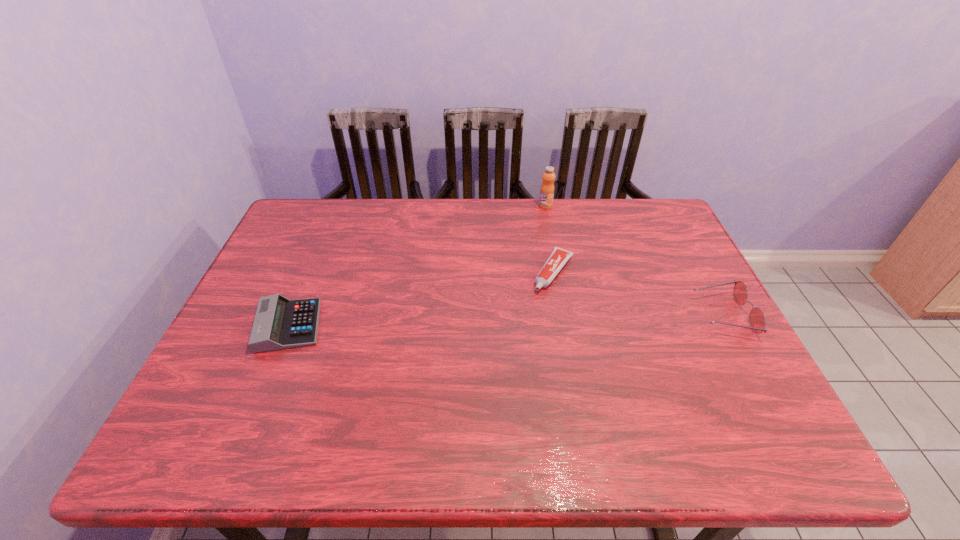
You are a GUI agent. You are given a task and a screenshot of the screen. Output one action in this format:
    pyautogui.click(x=<x>, y=<y>)
    Task: Click on the free space between the toothpaste and the calculator
    The image size is (960, 540).
    Given the screenshot: What is the action you would take?
    pyautogui.click(x=421, y=299)

I want to click on free space between the leftmost object and the third shortest object, so click(506, 320).

The height and width of the screenshot is (540, 960). What are the coordinates of `free area in between the third shortest object and the toothpaste` in the screenshot? It's located at (638, 294).

This screenshot has height=540, width=960. I want to click on vacant area between the second tallest object and the toothpaste, so click(x=638, y=294).

Find the location of a particular element. The height and width of the screenshot is (540, 960). empty location between the farthest object and the calculator is located at coordinates (418, 266).

Locate an element on the screen. vacant space that is in between the rightmost object and the farthest object is located at coordinates (634, 260).

Identify the location of object that is the second closest to the orange juice. The height and width of the screenshot is (540, 960). (757, 320).

This screenshot has width=960, height=540. Find the location of `object that is the second nearest to the toothpaste`. object that is the second nearest to the toothpaste is located at coordinates (757, 320).

Find the location of `free space that satisfies the following two spatial constraints: 1. on the back side of the leftmost object; 2. on the front-facing side of the spectacles`. free space that satisfies the following two spatial constraints: 1. on the back side of the leftmost object; 2. on the front-facing side of the spectacles is located at coordinates (294, 315).

The height and width of the screenshot is (540, 960). I want to click on blank space that satisfies the following two spatial constraints: 1. on the front side of the toothpaste; 2. on the front-facing side of the second tallest object, so tap(562, 315).